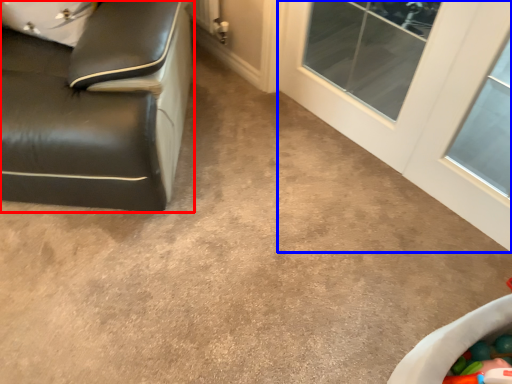
Question: Which object is closer to the camera taking this photo, furniture (highlighted by a red box) or glass door (highlighted by a blue box)?

Choices:
 (A) furniture
 (B) glass door

Answer: (A)